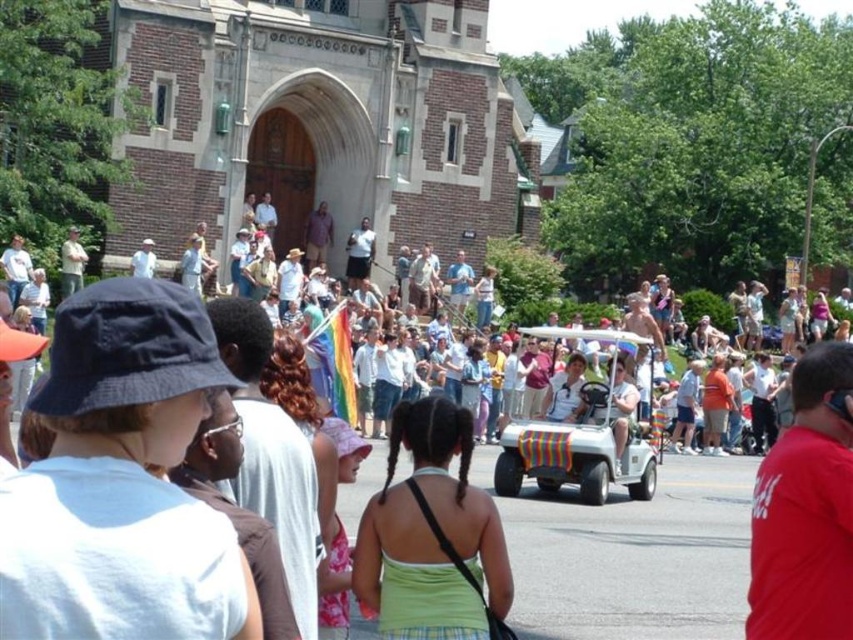
Does red cotton shirt at right have a greater height compared to white plastic golf cart at center?

Correct, red cotton shirt at right is much taller as white plastic golf cart at center.

Who is more distant from viewer, (785,588) or (576,476)?

The point (576,476) is behind.

I want to click on red cotton shirt at right, so click(x=805, y=509).

Does rainbow striped cart at center have a greater width compared to white plastic golf cart at center?

Correct, the width of rainbow striped cart at center exceeds that of white plastic golf cart at center.

Is point (738, 589) closer to viewer compared to point (633, 440)?

Yes, it is in front of point (633, 440).

Which is behind, point (519, 566) or point (553, 477)?

The point (553, 477) is behind.

Where is `rainbow striped cart at center`? The height and width of the screenshot is (640, 853). rainbow striped cart at center is located at coordinates (635, 556).

Does point (656, 534) lie behind point (405, 419)?

Yes, it is behind point (405, 419).

Who is more distant from viewer, (489, 490) or (424, 516)?

Point (489, 490)

What are the coordinates of `rainbow striped cart at center` in the screenshot? It's located at (635, 556).

At what (x,y) coordinates should I click in order to perform the action: click on rainbow striped cart at center. Please return your answer as a coordinate pair (x, y). Looking at the image, I should click on (635, 556).